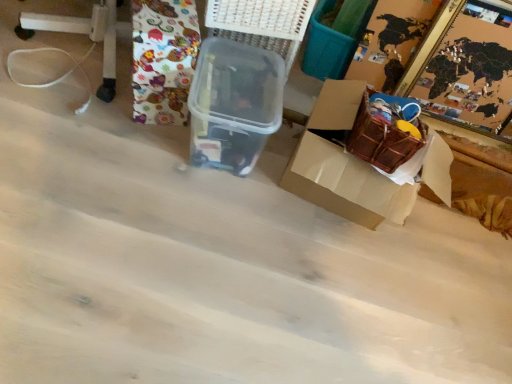
Find the location of `free location in front of brown cardboard box at lower right`. free location in front of brown cardboard box at lower right is located at coordinates (316, 302).